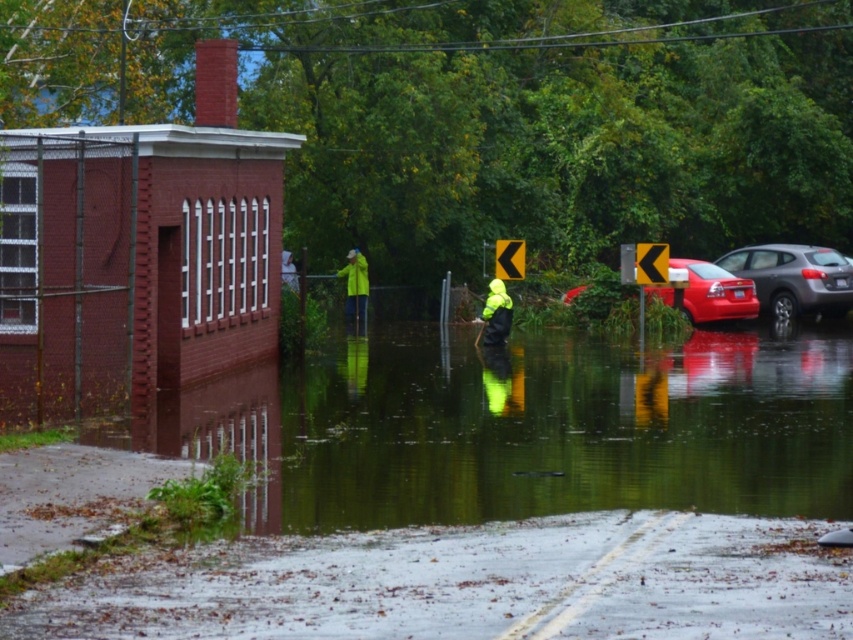
Question: Is green reflective water at center positioned at the back of yellow waterproof jacket at center?

Choices:
 (A) yes
 (B) no

Answer: (B)

Question: Can you confirm if matte gray suv at right is thinner than shiny red sedan at center?

Choices:
 (A) yes
 (B) no

Answer: (B)

Question: Which of the following is the farthest from the observer?

Choices:
 (A) (786, 480)
 (B) (346, 304)

Answer: (B)

Question: Which object is positioned farthest from the green reflective water at center?

Choices:
 (A) high-visibility yellow safety vest at center
 (B) matte gray suv at right
 (C) shiny red sedan at center
 (D) yellow matte jacket at center

Answer: (B)

Question: Which of these objects is positioned farthest from the green reflective water at center?

Choices:
 (A) high-visibility yellow safety vest at center
 (B) yellow matte jacket at center

Answer: (B)

Question: Does yellow matte jacket at center appear on the right side of high-visibility yellow safety vest at center?

Choices:
 (A) no
 (B) yes

Answer: (A)